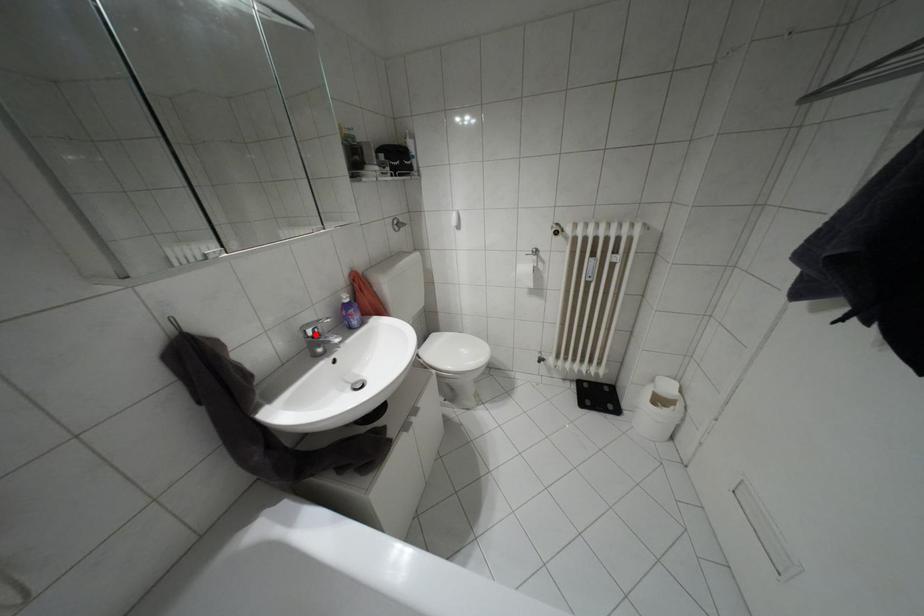
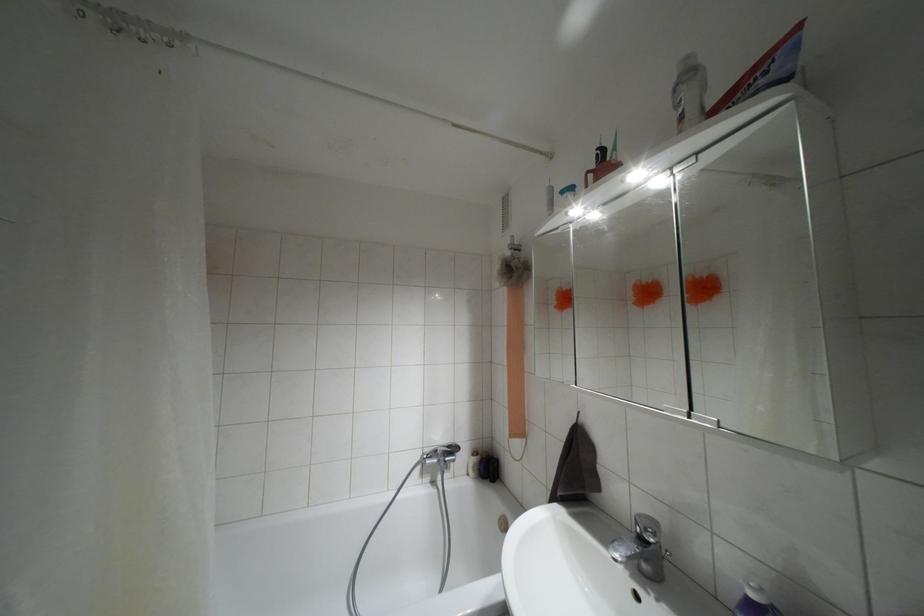
Question: A red point is marked in image1. In image2, is the corresponding 3D point closer to the camera or farther? Reply with the corresponding letter.

Choices:
 (A) The corresponding 3D point is closer.
 (B) The corresponding 3D point is farther.

Answer: (B)